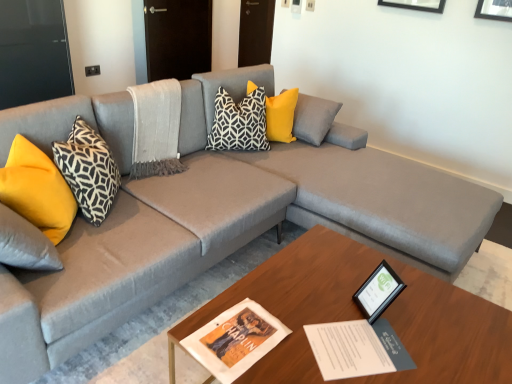
Find the location of a particular element. blank space to the left of white paper booklet at center is located at coordinates (276, 334).